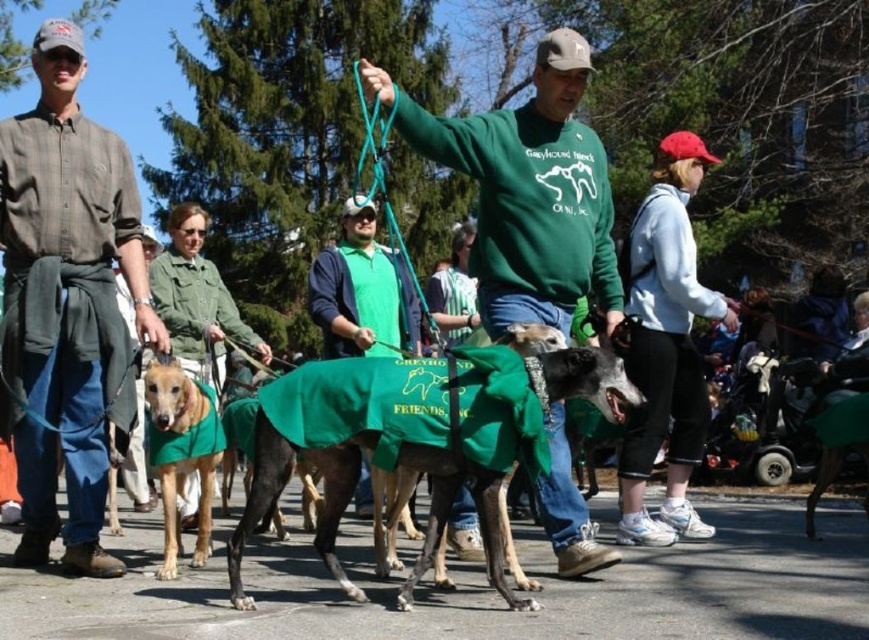
Question: Which object is positioned farthest from the plaid shirt at left?

Choices:
 (A) green fleece sweatshirt at center
 (B) white fleece jacket at upper right

Answer: (B)

Question: Estimate the real-world distances between objects in this image. Which object is closer to the green fabric-covered dog at center?

Choices:
 (A) green fleece sweatshirt at center
 (B) golden fur coat at center
 (C) plaid shirt at left

Answer: (A)

Question: Is green fleece vest at center wider than green fabric jacket at center?

Choices:
 (A) no
 (B) yes

Answer: (A)

Question: Estimate the real-world distances between objects in this image. Which object is closer to the green fleece vest at center?

Choices:
 (A) white fleece jacket at upper right
 (B) plaid shirt at left
 (C) golden fur coat at center
 (D) green fabric jacket at center

Answer: (D)

Question: Does green fleece sweatshirt at center appear on the left side of golden fur coat at center?

Choices:
 (A) no
 (B) yes

Answer: (A)

Question: Can you confirm if plaid shirt at left is thinner than white fleece jacket at upper right?

Choices:
 (A) yes
 (B) no

Answer: (A)